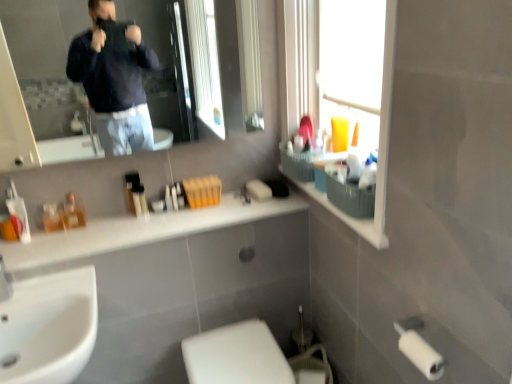
Where is `unoccupied region to the right of translucent plastic bottles at left, which appears as the 1th toiletry when viewed from the left`? This screenshot has width=512, height=384. unoccupied region to the right of translucent plastic bottles at left, which appears as the 1th toiletry when viewed from the left is located at coordinates (102, 229).